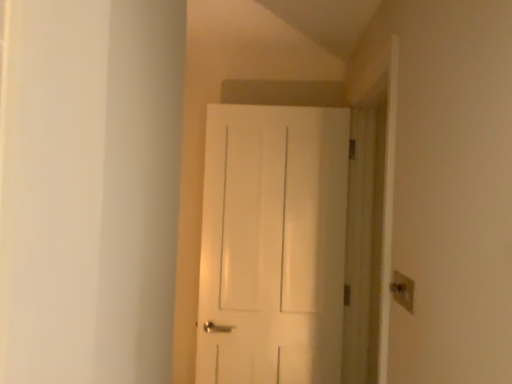
Question: From a real-world perspective, is beige plastic light switch at upper right on white matte door at center?

Choices:
 (A) yes
 (B) no

Answer: (B)

Question: From a real-world perspective, is beige plastic light switch at upper right below white matte door at center?

Choices:
 (A) yes
 (B) no

Answer: (A)

Question: Considering the relative sizes of beige plastic light switch at upper right and white matte door at center in the image provided, is beige plastic light switch at upper right bigger than white matte door at center?

Choices:
 (A) no
 (B) yes

Answer: (A)

Question: Is beige plastic light switch at upper right not within white matte door at center?

Choices:
 (A) yes
 (B) no

Answer: (A)

Question: Does beige plastic light switch at upper right have a lesser width compared to white matte door at center?

Choices:
 (A) yes
 (B) no

Answer: (A)

Question: From the image's perspective, is beige plastic light switch at upper right located above white matte door at center?

Choices:
 (A) no
 (B) yes

Answer: (A)

Question: Is white matte door at center facing away from beige plastic light switch at upper right?

Choices:
 (A) no
 (B) yes

Answer: (A)

Question: From the image's perspective, would you say white matte door at center is shown under beige plastic light switch at upper right?

Choices:
 (A) yes
 (B) no

Answer: (B)

Question: Can you confirm if white matte door at center is thinner than beige plastic light switch at upper right?

Choices:
 (A) no
 (B) yes

Answer: (A)

Question: Is white matte door at center taller than beige plastic light switch at upper right?

Choices:
 (A) no
 (B) yes

Answer: (B)

Question: From a real-world perspective, is white matte door at center under beige plastic light switch at upper right?

Choices:
 (A) yes
 (B) no

Answer: (B)

Question: Considering the relative positions of white matte door at center and beige plastic light switch at upper right in the image provided, is white matte door at center in front of beige plastic light switch at upper right?

Choices:
 (A) yes
 (B) no

Answer: (B)

Question: From the image's perspective, is white matte door at center above or below beige plastic light switch at upper right?

Choices:
 (A) above
 (B) below

Answer: (A)